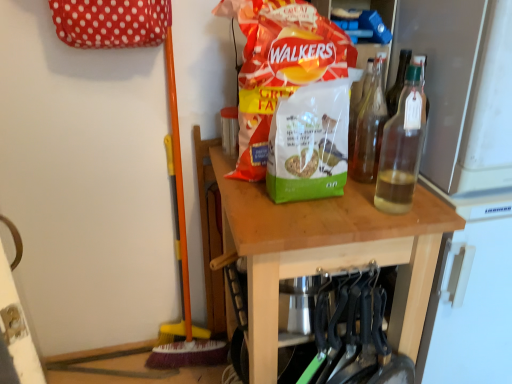
Describe the element at coordinates (290, 95) in the screenshot. I see `matte plastic bag of walkers crisps at center, the second waste positioned from the bottom` at that location.

The image size is (512, 384). What do you see at coordinates (369, 128) in the screenshot? I see `translucent glass bottle at center right, the first bottle viewed from the back` at bounding box center [369, 128].

This screenshot has height=384, width=512. Describe the element at coordinates (402, 147) in the screenshot. I see `clear glass bottle at upper right, which is counted as the second bottle, starting from the back` at that location.

Where is `matte plastic bag of walkers crisps at center, the second waste positioned from the bottom`? matte plastic bag of walkers crisps at center, the second waste positioned from the bottom is located at coordinates (290, 95).

In terms of width, does green matte birdseed bag at center, which is the second waste in top-to-bottom order, look wider or thinner when compared to matte plastic bag of walkers crisps at center, the second waste positioned from the bottom?

Considering their sizes, green matte birdseed bag at center, which is the second waste in top-to-bottom order, looks slimmer than matte plastic bag of walkers crisps at center, the second waste positioned from the bottom.

Is green matte birdseed bag at center, the 1th waste positioned from the bottom, looking in the opposite direction of matte plastic bag of walkers crisps at center, the second waste positioned from the bottom?

Yes.

Which is in front, point (316, 115) or point (324, 114)?

The point (316, 115) is more forward.

Is matte plastic bag of walkers crisps at center, the second waste positioned from the bottom, inside green matte birdseed bag at center, the 1th waste positioned from the bottom?

No.

Is matte plastic bag of walkers crisps at center, the second waste positioned from the bottom, looking in the opposite direction of clear glass bottle at upper right, which is the first bottle in front-to-back order?

No, clear glass bottle at upper right, which is the first bottle in front-to-back order, is not at the back of matte plastic bag of walkers crisps at center, the second waste positioned from the bottom.

Considering the positions of objects matte plastic bag of walkers crisps at center, the second waste positioned from the bottom, and clear glass bottle at upper right, which is the first bottle in front-to-back order, in the image provided, who is in front, matte plastic bag of walkers crisps at center, the second waste positioned from the bottom, or clear glass bottle at upper right, which is the first bottle in front-to-back order,?

clear glass bottle at upper right, which is the first bottle in front-to-back order, is closer to the camera.

Between matte plastic bag of walkers crisps at center, the second waste positioned from the bottom, and clear glass bottle at upper right, which is counted as the second bottle, starting from the back, which one has larger size?

matte plastic bag of walkers crisps at center, the second waste positioned from the bottom.

Which is correct: matte plastic bag of walkers crisps at center, arranged as the first waste when viewed from the top, is inside clear glass bottle at upper right, which is the first bottle in front-to-back order, or outside of it?

matte plastic bag of walkers crisps at center, arranged as the first waste when viewed from the top, cannot be found inside clear glass bottle at upper right, which is the first bottle in front-to-back order.

Considering the sizes of objects translucent glass bottle at center right, the first bottle viewed from the back, and matte plastic bag of walkers crisps at center, arranged as the first waste when viewed from the top, in the image provided, who is taller, translucent glass bottle at center right, the first bottle viewed from the back, or matte plastic bag of walkers crisps at center, arranged as the first waste when viewed from the top,?

matte plastic bag of walkers crisps at center, arranged as the first waste when viewed from the top.

In the scene shown: In terms of width, does translucent glass bottle at center right, which appears as the 2th bottle when viewed from the front, look wider or thinner when compared to matte plastic bag of walkers crisps at center, arranged as the first waste when viewed from the top?

Considering their sizes, translucent glass bottle at center right, which appears as the 2th bottle when viewed from the front, looks slimmer than matte plastic bag of walkers crisps at center, arranged as the first waste when viewed from the top.

Looking at this image, would you say translucent glass bottle at center right, which appears as the 2th bottle when viewed from the front, is to the left or to the right of matte plastic bag of walkers crisps at center, arranged as the first waste when viewed from the top, in the picture?

From the image, it's evident that translucent glass bottle at center right, which appears as the 2th bottle when viewed from the front, is to the right of matte plastic bag of walkers crisps at center, arranged as the first waste when viewed from the top.

From a real-world perspective, which object rests below the other?

From a 3D spatial view, translucent glass bottle at center right, which appears as the 2th bottle when viewed from the front, is below.

Which object is closer to the camera, matte plastic bag of walkers crisps at center, the second waste positioned from the bottom, or translucent glass bottle at center right, the first bottle viewed from the back?

Positioned in front is matte plastic bag of walkers crisps at center, the second waste positioned from the bottom.

Can you confirm if matte plastic bag of walkers crisps at center, the second waste positioned from the bottom, is positioned to the right of translucent glass bottle at center right, which appears as the 2th bottle when viewed from the front?

In fact, matte plastic bag of walkers crisps at center, the second waste positioned from the bottom, is to the left of translucent glass bottle at center right, which appears as the 2th bottle when viewed from the front.

Which of these two, matte plastic bag of walkers crisps at center, arranged as the first waste when viewed from the top, or translucent glass bottle at center right, which appears as the 2th bottle when viewed from the front, is wider?

Wider between the two is matte plastic bag of walkers crisps at center, arranged as the first waste when viewed from the top.

Is matte plastic bag of walkers crisps at center, the second waste positioned from the bottom, positioned with its back to translucent glass bottle at center right, the first bottle viewed from the back?

matte plastic bag of walkers crisps at center, the second waste positioned from the bottom, does not have its back to translucent glass bottle at center right, the first bottle viewed from the back.

Considering the relative sizes of clear glass bottle at upper right, which is the first bottle in front-to-back order, and translucent glass bottle at center right, the first bottle viewed from the back, in the image provided, is clear glass bottle at upper right, which is the first bottle in front-to-back order, thinner than translucent glass bottle at center right, the first bottle viewed from the back,?

Yes, clear glass bottle at upper right, which is the first bottle in front-to-back order, is thinner than translucent glass bottle at center right, the first bottle viewed from the back.

From a real-world perspective, is clear glass bottle at upper right, which is the first bottle in front-to-back order, above or below translucent glass bottle at center right, the first bottle viewed from the back?

clear glass bottle at upper right, which is the first bottle in front-to-back order, is situated higher than translucent glass bottle at center right, the first bottle viewed from the back, in the real world.

You are a GUI agent. You are given a task and a screenshot of the screen. Output one action in this format:
    pyautogui.click(x=<x>, y=<y>)
    Task: Click on the bottle that is above the clear glass bottle at upper right, which is counted as the second bottle, starting from the back (from the image's perspective)
    
    Given the screenshot: What is the action you would take?
    369,128

Looking at this image, does clear glass bottle at upper right, which is counted as the second bottle, starting from the back, have a smaller size compared to translucent glass bottle at center right, the first bottle viewed from the back?

Actually, clear glass bottle at upper right, which is counted as the second bottle, starting from the back, might be larger than translucent glass bottle at center right, the first bottle viewed from the back.

Is point (359, 164) farther from camera compared to point (411, 357)?

That is True.

From the image's perspective, starting from the wooden table at center, which bottle is the 2nd one above? Please provide its 2D coordinates.

[(369, 128)]

Is translucent glass bottle at center right, the first bottle viewed from the back, bigger or smaller than wooden table at center?

translucent glass bottle at center right, the first bottle viewed from the back, is smaller than wooden table at center.

Is point (417, 126) closer to camera compared to point (294, 163)?

Yes, it is in front of point (294, 163).

Is clear glass bottle at upper right, which is the first bottle in front-to-back order, bigger or smaller than matte plastic bag of walkers crisps at center, arranged as the first waste when viewed from the top?

clear glass bottle at upper right, which is the first bottle in front-to-back order, is smaller than matte plastic bag of walkers crisps at center, arranged as the first waste when viewed from the top.

From the picture: Choose the correct answer: Is clear glass bottle at upper right, which is the first bottle in front-to-back order, inside matte plastic bag of walkers crisps at center, arranged as the first waste when viewed from the top, or outside it?

clear glass bottle at upper right, which is the first bottle in front-to-back order, is outside matte plastic bag of walkers crisps at center, arranged as the first waste when viewed from the top.

From a real-world perspective, relative to matte plastic bag of walkers crisps at center, arranged as the first waste when viewed from the top, is clear glass bottle at upper right, which is counted as the second bottle, starting from the back, vertically above or below?

clear glass bottle at upper right, which is counted as the second bottle, starting from the back, is below matte plastic bag of walkers crisps at center, arranged as the first waste when viewed from the top.

You are a GUI agent. You are given a task and a screenshot of the screen. Output one action in this format:
    pyautogui.click(x=<x>, y=<y>)
    Task: Click on the waste below the matte plastic bag of walkers crisps at center, the second waste positioned from the bottom (from the image's perspective)
    
    Given the screenshot: What is the action you would take?
    pyautogui.click(x=309, y=143)

Locate an element on the screen. the 2nd bottle to the right when counting from the matte plastic bag of walkers crisps at center, the second waste positioned from the bottom is located at coordinates (402, 147).

From the image, which object appears to be nearer to wooden table at center, clear glass bottle at upper right, which is counted as the second bottle, starting from the back, or green matte birdseed bag at center, which is the second waste in top-to-bottom order?

green matte birdseed bag at center, which is the second waste in top-to-bottom order, is closer to wooden table at center.

Which object lies nearer to the anchor point clear glass bottle at upper right, which is the first bottle in front-to-back order, translucent glass bottle at center right, the first bottle viewed from the back, or wooden table at center?

Among the two, translucent glass bottle at center right, the first bottle viewed from the back, is located nearer to clear glass bottle at upper right, which is the first bottle in front-to-back order.

From the image, which object appears to be nearer to green matte birdseed bag at center, the 1th waste positioned from the bottom, matte plastic bag of walkers crisps at center, the second waste positioned from the bottom, or clear glass bottle at upper right, which is the first bottle in front-to-back order?

matte plastic bag of walkers crisps at center, the second waste positioned from the bottom.

Considering their positions, is translucent glass bottle at center right, which appears as the 2th bottle when viewed from the front, positioned further to wooden table at center than matte plastic bag of walkers crisps at center, the second waste positioned from the bottom?

The object further to wooden table at center is translucent glass bottle at center right, which appears as the 2th bottle when viewed from the front.

Consider the image. Looking at the image, which one is located closer to wooden table at center, green matte birdseed bag at center, the 1th waste positioned from the bottom, or clear glass bottle at upper right, which is the first bottle in front-to-back order?

The object closer to wooden table at center is green matte birdseed bag at center, the 1th waste positioned from the bottom.

Estimate the real-world distances between objects in this image. Which object is further from matte plastic bag of walkers crisps at center, arranged as the first waste when viewed from the top, clear glass bottle at upper right, which is the first bottle in front-to-back order, or green matte birdseed bag at center, which is the second waste in top-to-bottom order?

clear glass bottle at upper right, which is the first bottle in front-to-back order, is positioned further to the anchor matte plastic bag of walkers crisps at center, arranged as the first waste when viewed from the top.

Based on the photo, considering their positions, is wooden table at center positioned further to translucent glass bottle at center right, which appears as the 2th bottle when viewed from the front, than matte plastic bag of walkers crisps at center, the second waste positioned from the bottom?

wooden table at center lies further to translucent glass bottle at center right, which appears as the 2th bottle when viewed from the front, than the other object.

Looking at the image, which one is located further to clear glass bottle at upper right, which is counted as the second bottle, starting from the back, matte plastic bag of walkers crisps at center, arranged as the first waste when viewed from the top, or translucent glass bottle at center right, the first bottle viewed from the back?

matte plastic bag of walkers crisps at center, arranged as the first waste when viewed from the top, is positioned further to the anchor clear glass bottle at upper right, which is counted as the second bottle, starting from the back.

Find the location of a particular element. The height and width of the screenshot is (384, 512). bottle between translucent glass bottle at center right, the first bottle viewed from the back, and wooden table at center, in the vertical direction is located at coordinates (402, 147).

Where is `waste situated between matte plastic bag of walkers crisps at center, the second waste positioned from the bottom, and translucent glass bottle at center right, the first bottle viewed from the back, from left to right`? waste situated between matte plastic bag of walkers crisps at center, the second waste positioned from the bottom, and translucent glass bottle at center right, the first bottle viewed from the back, from left to right is located at coordinates point(309,143).

Locate an element on the screen. The height and width of the screenshot is (384, 512). waste between matte plastic bag of walkers crisps at center, the second waste positioned from the bottom, and clear glass bottle at upper right, which is counted as the second bottle, starting from the back, in the horizontal direction is located at coordinates (309, 143).

This screenshot has height=384, width=512. What are the coordinates of `bottle between green matte birdseed bag at center, the 1th waste positioned from the bottom, and wooden table at center, in the vertical direction` in the screenshot? It's located at (402, 147).